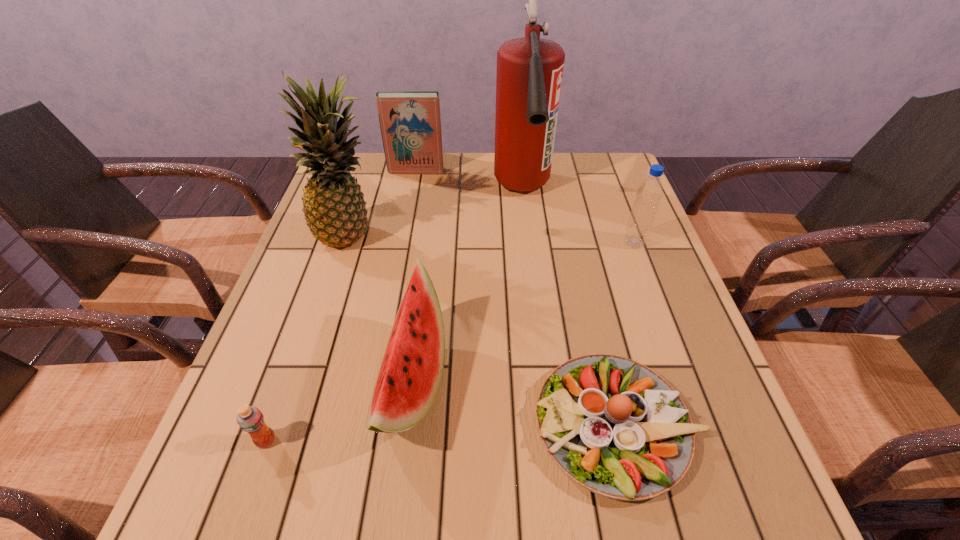
You are a GUI agent. You are given a task and a screenshot of the screen. Output one action in this format:
    pyautogui.click(x=<x>, y=<y>)
    Task: Click on the free point between the tallest object and the salad plate
    The image size is (960, 540).
    Given the screenshot: What is the action you would take?
    569,308

You are a GUI agent. You are given a task and a screenshot of the screen. Output one action in this format:
    pyautogui.click(x=<x>, y=<y>)
    Task: Click on the free spot between the hardback book and the orange juice
    The width and height of the screenshot is (960, 540).
    Given the screenshot: What is the action you would take?
    pyautogui.click(x=341, y=306)

Locate an element on the screen. free space between the hardback book and the second shortest object is located at coordinates (341, 306).

I want to click on free spot between the fire extinguisher and the orange juice, so click(394, 316).

Where is `empty space between the salad plate and the pineapple`? Image resolution: width=960 pixels, height=540 pixels. empty space between the salad plate and the pineapple is located at coordinates [484, 331].

The image size is (960, 540). Identify the location of free space between the second shortest object and the water bottle. (450, 342).

This screenshot has height=540, width=960. I want to click on vacant area between the tallest object and the water bottle, so click(578, 217).

Identify which object is the fourth closest to the hardback book. Please provide its 2D coordinates. Your answer should be formatted as a tuple, i.e. [(x, y)], where the tuple contains the x and y coordinates of a point satisfying the conditions above.

[(409, 378)]

Identify which object is the third nearest to the hardback book. Please provide its 2D coordinates. Your answer should be formatted as a tuple, i.e. [(x, y)], where the tuple contains the x and y coordinates of a point satisfying the conditions above.

[(649, 193)]

Image resolution: width=960 pixels, height=540 pixels. I want to click on free region that satisfies the following two spatial constraints: 1. on the back side of the sixth tallest object; 2. on the right side of the salad plate, so click(x=272, y=424).